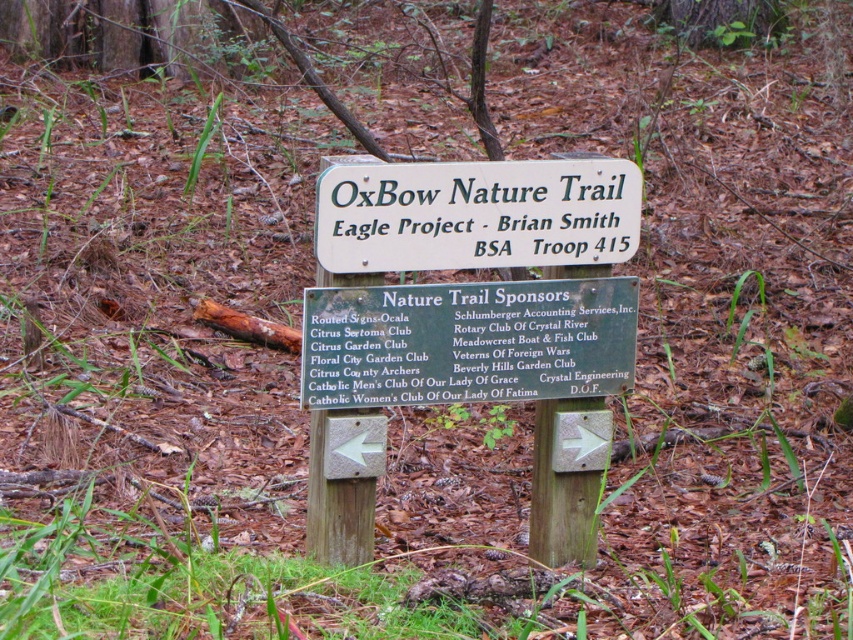
Describe the element at coordinates (467, 340) in the screenshot. I see `green wood sign at center` at that location.

Is green wood sign at center taller than white wood sign at center?

Correct, green wood sign at center is much taller as white wood sign at center.

You are a GUI agent. You are given a task and a screenshot of the screen. Output one action in this format:
    pyautogui.click(x=<x>, y=<y>)
    Task: Click on the green wood sign at center
    
    Given the screenshot: What is the action you would take?
    pyautogui.click(x=467, y=340)